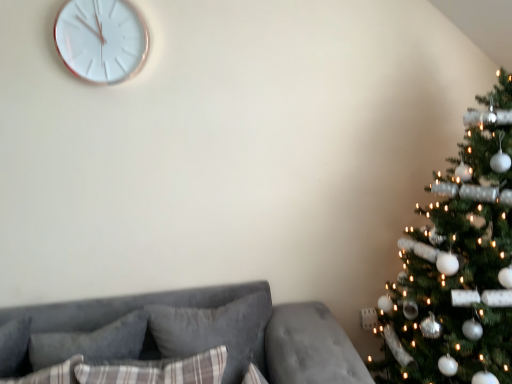
Question: Is green textured christmas tree at right closer to camera compared to velvet gray couch at lower left?

Choices:
 (A) no
 (B) yes

Answer: (B)

Question: Considering the relative positions of green textured christmas tree at right and velvet gray couch at lower left in the image provided, is green textured christmas tree at right to the right of velvet gray couch at lower left from the viewer's perspective?

Choices:
 (A) no
 (B) yes

Answer: (B)

Question: Is green textured christmas tree at right bigger than velvet gray couch at lower left?

Choices:
 (A) no
 (B) yes

Answer: (B)

Question: Considering the relative sizes of green textured christmas tree at right and velvet gray couch at lower left in the image provided, is green textured christmas tree at right shorter than velvet gray couch at lower left?

Choices:
 (A) no
 (B) yes

Answer: (A)

Question: Is green textured christmas tree at right facing away from velvet gray couch at lower left?

Choices:
 (A) no
 (B) yes

Answer: (A)

Question: From the image's perspective, is plaid fabric pillow at center, which ranks as the 3th pillow in back-to-front order, above or below plush gray pillow at center, placed as the first pillow when sorted from back to front?

Choices:
 (A) above
 (B) below

Answer: (B)

Question: In the image, is plaid fabric pillow at center, which ranks as the 3th pillow in back-to-front order, on the left side or the right side of plush gray pillow at center, placed as the third pillow when sorted from front to back?

Choices:
 (A) left
 (B) right

Answer: (A)

Question: Is plaid fabric pillow at center, which is the first pillow in front-to-back order, wider or thinner than plush gray pillow at center, placed as the third pillow when sorted from front to back?

Choices:
 (A) thin
 (B) wide

Answer: (B)

Question: Considering their positions, is plaid fabric pillow at center, which ranks as the 3th pillow in back-to-front order, located in front of or behind plush gray pillow at center, placed as the first pillow when sorted from back to front?

Choices:
 (A) behind
 (B) front

Answer: (B)

Question: Considering the relative positions of white glossy clock at upper left and velvet gray couch at lower left in the image provided, is white glossy clock at upper left to the left or to the right of velvet gray couch at lower left?

Choices:
 (A) left
 (B) right

Answer: (A)

Question: Looking at their shapes, would you say white glossy clock at upper left is wider or thinner than velvet gray couch at lower left?

Choices:
 (A) wide
 (B) thin

Answer: (B)

Question: From a real-world perspective, is white glossy clock at upper left physically located above or below velvet gray couch at lower left?

Choices:
 (A) above
 (B) below

Answer: (A)

Question: From the image's perspective, is white glossy clock at upper left above or below velvet gray couch at lower left?

Choices:
 (A) below
 (B) above

Answer: (B)

Question: Based on their sizes in the image, would you say plush gray pillow at lower left, which appears as the second pillow when viewed from the back, is bigger or smaller than white glossy clock at upper left?

Choices:
 (A) small
 (B) big

Answer: (B)

Question: From the image's perspective, is plush gray pillow at lower left, acting as the second pillow starting from the front, above or below white glossy clock at upper left?

Choices:
 (A) below
 (B) above

Answer: (A)